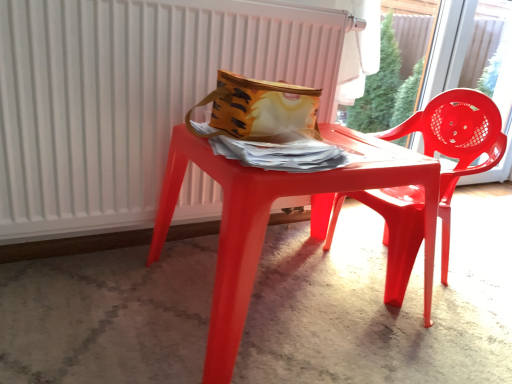
Question: From a real-world perspective, is white plastic radiator at upper center positioned above or below glossy plastic table at center?

Choices:
 (A) below
 (B) above

Answer: (B)

Question: Does point (48, 153) appear closer or farther from the camera than point (331, 127)?

Choices:
 (A) closer
 (B) farther

Answer: (A)

Question: Which is nearer to the glossy plastic table at center?

Choices:
 (A) transparent plastic chair at upper right
 (B) glossy plastic chair at right
 (C) white plastic radiator at upper center
 (D) matte yellow fabric bag at center

Answer: (D)

Question: Which object is positioned farthest from the matte yellow fabric bag at center?

Choices:
 (A) white plastic radiator at upper center
 (B) glossy plastic chair at right
 (C) glossy plastic table at center
 (D) transparent plastic chair at upper right

Answer: (D)